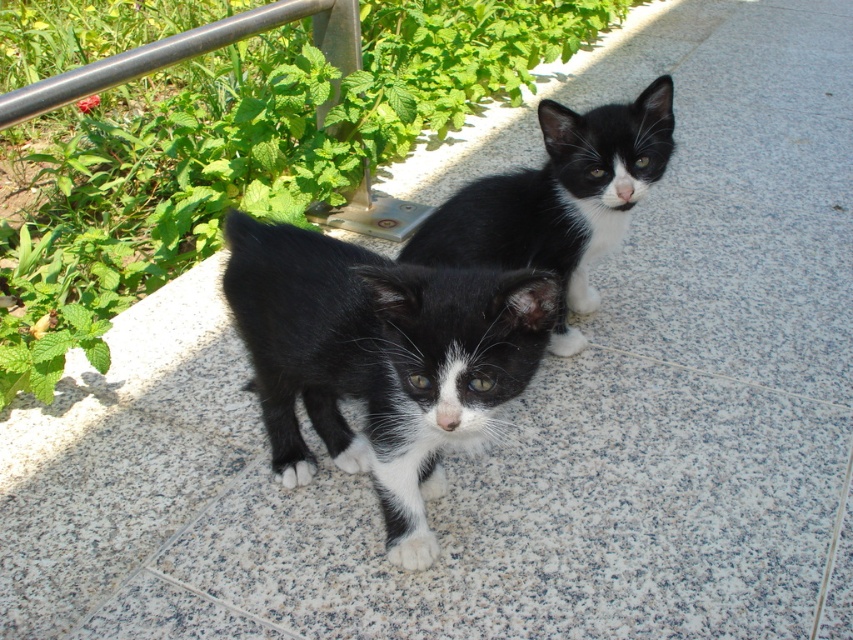
Question: Which object appears closest to the camera in this image?

Choices:
 (A) black fur kitten at center
 (B) black matte fur cat at upper center

Answer: (A)

Question: Can you confirm if black fur kitten at center is positioned to the left of black matte fur cat at upper center?

Choices:
 (A) yes
 (B) no

Answer: (A)

Question: Which point is closer to the camera?

Choices:
 (A) (544, 140)
 (B) (410, 467)

Answer: (B)

Question: Among these points, which one is nearest to the camera?

Choices:
 (A) (511, 195)
 (B) (308, 240)

Answer: (B)

Question: Does black fur kitten at center appear on the left side of black matte fur cat at upper center?

Choices:
 (A) no
 (B) yes

Answer: (B)

Question: Is black fur kitten at center wider than black matte fur cat at upper center?

Choices:
 (A) no
 (B) yes

Answer: (A)